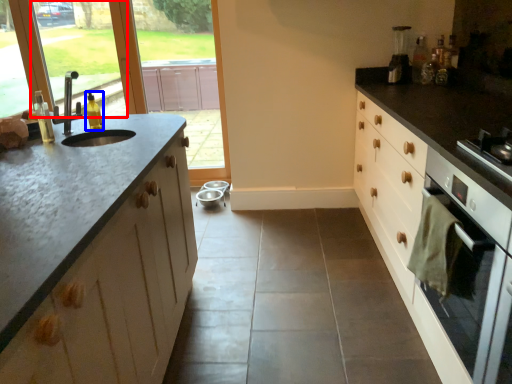
Question: Which of the following is the closest to the observer, window screen (highlighted by a red box) or bottle (highlighted by a blue box)?

Choices:
 (A) window screen
 (B) bottle

Answer: (B)